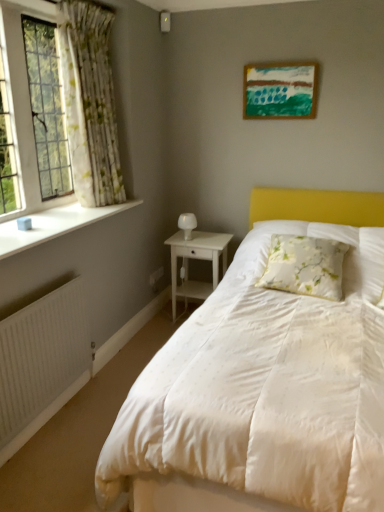
Identify the location of vacant space underneath white ribbed radiator at lower left (from a real-world perspective). (59, 417).